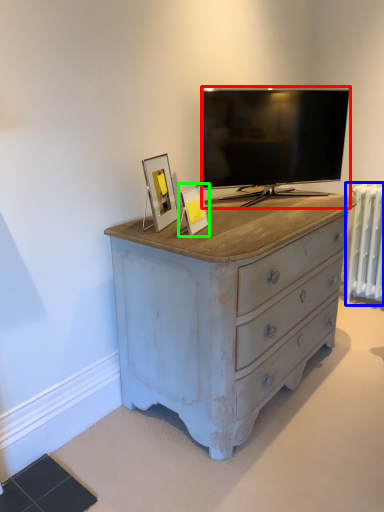
Question: Considering the real-world distances, which object is closest to television (highlighted by a red box)? radiator (highlighted by a blue box) or picture frame (highlighted by a green box).

Choices:
 (A) radiator
 (B) picture frame

Answer: (B)